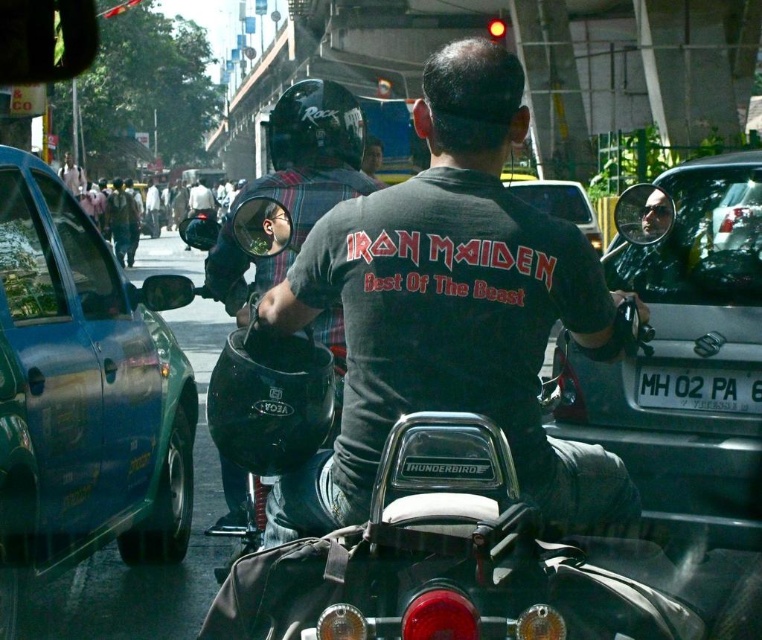
You are a delivery person who needs to cross the street safely. There is a green matte car at left and a dark gray helmet at center. What is the minimum distance you should maintain between yourself and these two objects to ensure safety?

The distance between the green matte car at left and dark gray helmet at center is 5.18 meters. To ensure safety, you should maintain a minimum distance of at least 5.18 meters from both objects.

You are a photographer trying to capture the matte black helmet at center and the metallic silver car at center in the same frame. Since you want to emphasize both objects equally, which one should you move closer to, and why?

You should move closer to the metallic silver car at center because the matte black helmet at center is bigger than the metallic silver car at center. By moving closer to the smaller object, you can balance their sizes in the frame.

You are a delivery person who needs to place both the matte black helmet at center and the metallic silver car at center into a storage box. The box can only accommodate items with a maximum width of 1 meter. Based on the scene, can both items fit inside the box?

The matte black helmet at center is wider than the metallic silver car at center. Since the box has a maximum width of 1 meter, we need to know the exact width of the helmet. However, the description only states that the helmet is wider than the car. Without specific measurements, we cannot confirm if both will fit. Please provide the exact width of the matte black helmet at center.